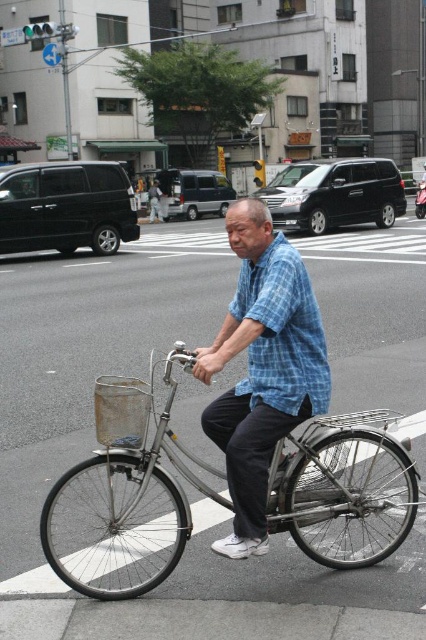
You are standing on the sidewalk and see two points marked on the road ahead. One is at point (285, 493) and the other is at point (278, 378). Which point is closer to you?

Point (285, 493) is closer to you because it is further to the viewer than point (278, 378).

You are a pedestrian standing at the crosswalk and see the silver metallic bicycle at center and the blue plaid shirt at center. Which object is positioned to the left of the other?

The silver metallic bicycle at center is to the left of the blue plaid shirt at center.